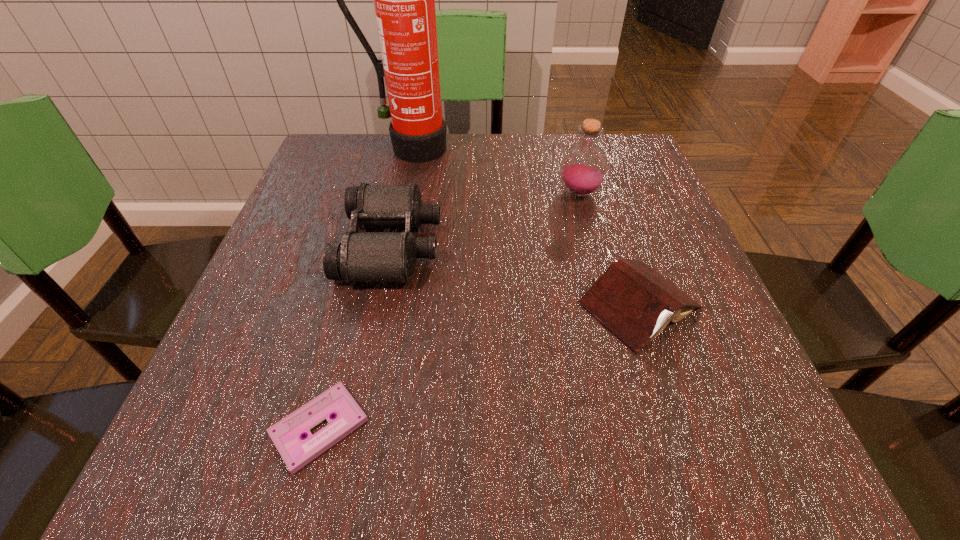
Locate an element on the screen. Image resolution: width=960 pixels, height=540 pixels. object at the far left corner is located at coordinates (404, 0).

At what (x,y) coordinates should I click in order to perform the action: click on object that is at the near left corner. Please return your answer as a coordinate pair (x, y). This screenshot has height=540, width=960. Looking at the image, I should click on (287, 434).

Locate an element on the screen. object that is at the far right corner is located at coordinates (583, 168).

At what (x,y) coordinates should I click in order to perform the action: click on free space at the far edge of the desktop. Please return your answer as a coordinate pair (x, y). The height and width of the screenshot is (540, 960). Looking at the image, I should click on (535, 159).

Identify the location of free space at the left edge of the desktop. This screenshot has height=540, width=960. (260, 284).

At what (x,y) coordinates should I click in order to perform the action: click on free space at the right edge of the desktop. Please return your answer as a coordinate pair (x, y). Looking at the image, I should click on (616, 249).

This screenshot has width=960, height=540. I want to click on vacant space at the far left corner of the desktop, so click(373, 148).

In the image, there is a desktop. Where is `vacant space at the far right corner`? This screenshot has height=540, width=960. vacant space at the far right corner is located at coordinates (655, 184).

Identify the location of vacant area at the near right corner. This screenshot has width=960, height=540. click(x=678, y=427).

Locate an element on the screen. The height and width of the screenshot is (540, 960). empty location between the farthest object and the nearest object is located at coordinates (365, 288).